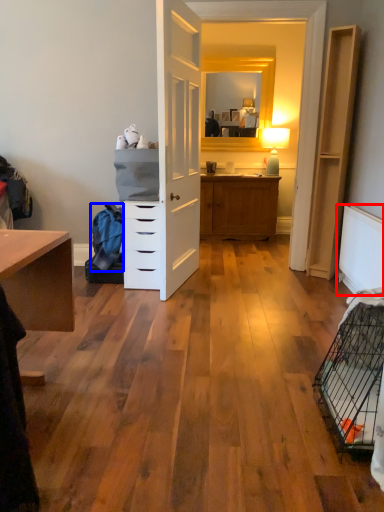
Question: Among these objects, which one is nearest to the camera, radiator (highlighted by a red box) or material (highlighted by a blue box)?

Choices:
 (A) radiator
 (B) material

Answer: (A)